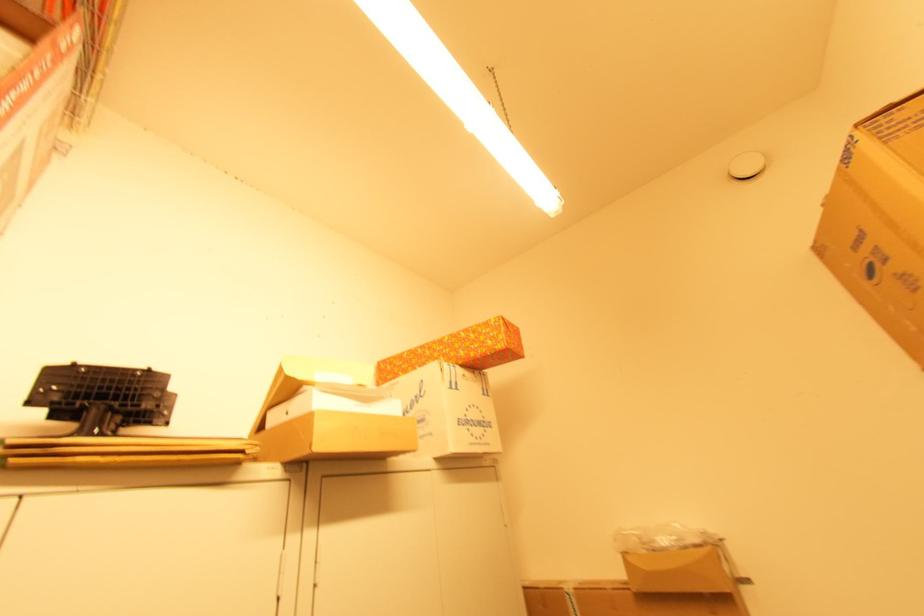
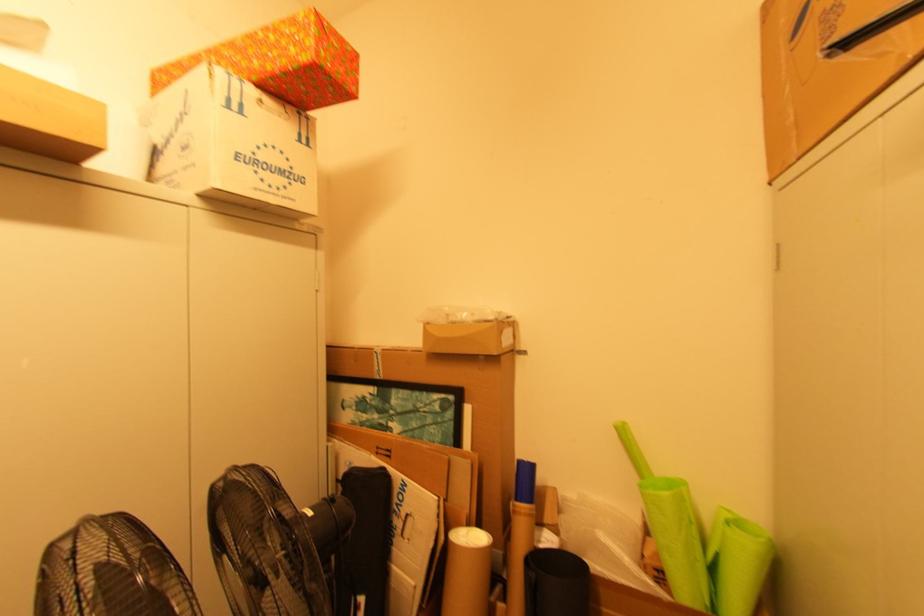
The point at (468,416) is marked in the first image. Where is the corresponding point in the second image?

(257, 154)